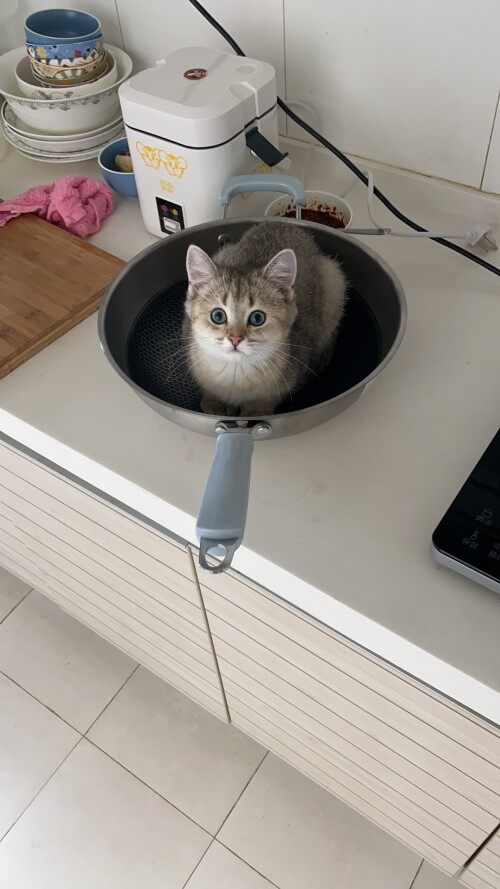
Where is `towel`? The height and width of the screenshot is (889, 500). towel is located at coordinates (83, 193).